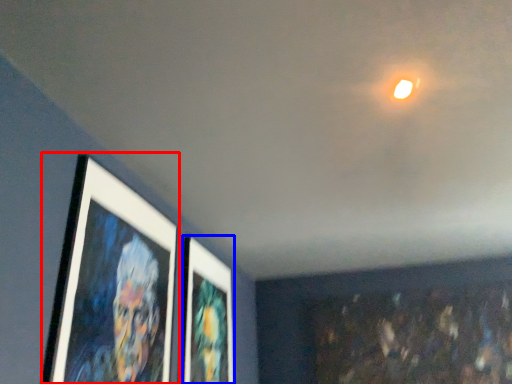
Question: Which object is closer to the camera taking this photo, picture frame (highlighted by a red box) or picture frame (highlighted by a blue box)?

Choices:
 (A) picture frame
 (B) picture frame

Answer: (A)